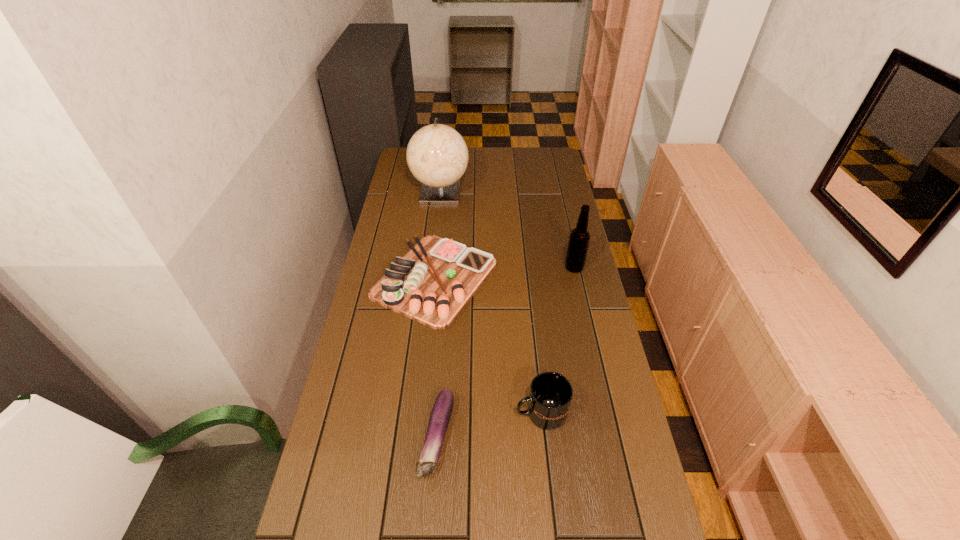
You are a GUI agent. You are given a task and a screenshot of the screen. Output one action in this format:
    pyautogui.click(x=<x>, y=<y>)
    Task: Click on the free region at the left edge of the desktop
    The height and width of the screenshot is (540, 960).
    Given the screenshot: What is the action you would take?
    pyautogui.click(x=354, y=390)

The height and width of the screenshot is (540, 960). I want to click on free region at the right edge, so click(x=599, y=361).

Find the location of a particular element. The image size is (960, 540). free location at the far left corner of the desktop is located at coordinates (407, 168).

Image resolution: width=960 pixels, height=540 pixels. Find the location of `vacant area at the far right corner of the desktop`. vacant area at the far right corner of the desktop is located at coordinates (556, 166).

This screenshot has width=960, height=540. Identify the location of vacant area between the second shortest object and the shortest object. (436, 359).

You are a GUI agent. You are given a task and a screenshot of the screen. Output one action in this format:
    pyautogui.click(x=<x>, y=<y>)
    Task: Click on the free point between the third shortest object and the globe
    The height and width of the screenshot is (540, 960).
    Given the screenshot: What is the action you would take?
    pyautogui.click(x=491, y=302)

Image resolution: width=960 pixels, height=540 pixels. I want to click on free space between the eggplant and the second object from right to left, so click(x=489, y=426).

At what (x,y) coordinates should I click in order to perform the action: click on vacant point located between the mug and the second shortest object. Please return your answer as a coordinate pair (x, y). Looking at the image, I should click on (488, 346).

Locate an element on the screen. The height and width of the screenshot is (540, 960). empty location between the beer bottle and the second shortest object is located at coordinates (505, 273).

Locate an element on the screen. vacant area that lies between the second tallest object and the eggplant is located at coordinates pos(506,353).